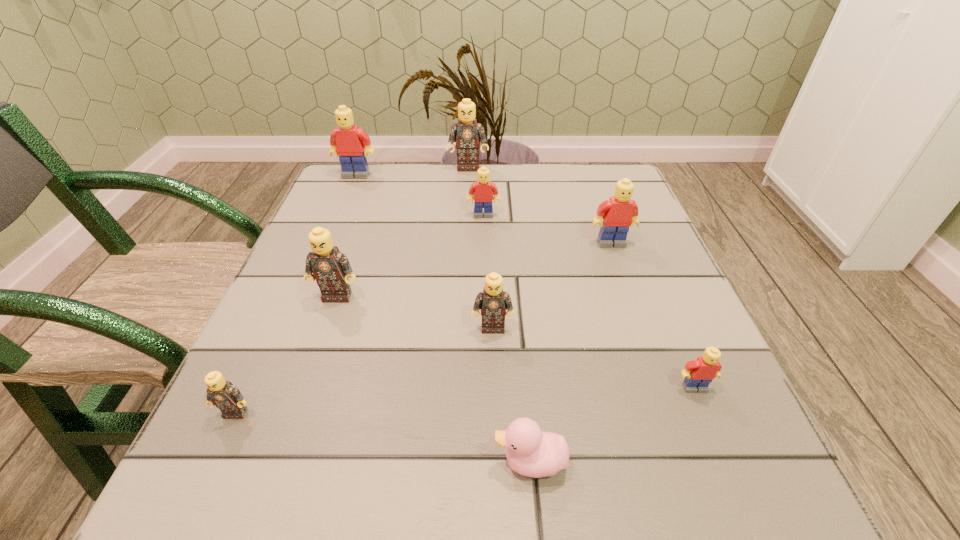
Where is `vacant space positioned 0.180m in front of the third nearest tan Lego`? The width and height of the screenshot is (960, 540). vacant space positioned 0.180m in front of the third nearest tan Lego is located at coordinates (305, 388).

Where is `free space located on the front-facing side of the seventh nearest object`? free space located on the front-facing side of the seventh nearest object is located at coordinates (485, 329).

This screenshot has height=540, width=960. Find the location of `free space located in front of the third nearest Lego`. free space located in front of the third nearest Lego is located at coordinates (493, 368).

What are the coordinates of `vacant area located on the front-facing side of the nearest yellow Lego` in the screenshot? It's located at (709, 424).

Image resolution: width=960 pixels, height=540 pixels. Identify the location of blank space located on the front-facing side of the pink duckling. (190, 462).

The width and height of the screenshot is (960, 540). Identify the location of blank space located on the front-facing side of the pink duckling. (213, 462).

The height and width of the screenshot is (540, 960). I want to click on free space located 0.130m on the front-facing side of the pink duckling, so click(396, 462).

At what (x,y) coordinates should I click in order to perform the action: click on object located at the near edge. Please return your answer as a coordinate pair (x, y). This screenshot has height=540, width=960. Looking at the image, I should click on (531, 452).

Locate an element on the screen. The width and height of the screenshot is (960, 540). object at the far left corner is located at coordinates (348, 142).

In order to click on vacant space at the far edge in this screenshot , I will do `click(443, 184)`.